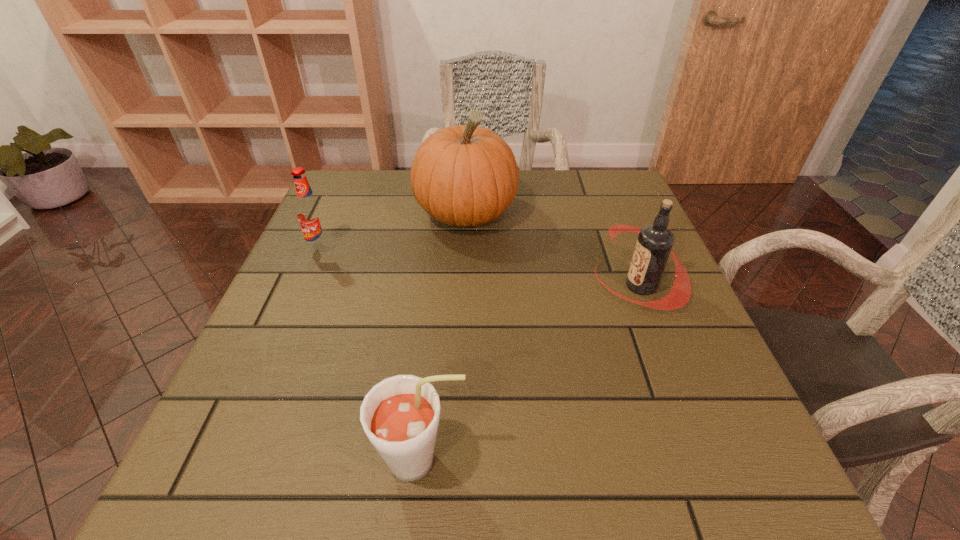
This screenshot has width=960, height=540. I want to click on vacant space at the right edge of the desktop, so click(662, 428).

Where is `free location at the far left corner`? The image size is (960, 540). free location at the far left corner is located at coordinates (375, 186).

Locate an element on the screen. free space at the near left corner of the desktop is located at coordinates (273, 449).

What are the coordinates of `blank space at the near right corner` in the screenshot? It's located at pyautogui.click(x=718, y=453).

In order to click on free space between the nearest root beer and the rightmost object in this screenshot , I will do `click(531, 373)`.

You are a GUI agent. You are given a task and a screenshot of the screen. Output one action in this format:
    pyautogui.click(x=<x>, y=<y>)
    Task: Click on the free space between the farthest root beer and the rightmost object
    This screenshot has width=960, height=540.
    Given the screenshot: What is the action you would take?
    pyautogui.click(x=480, y=267)

Locate an element on the screen. This screenshot has height=540, width=960. blank region between the pumpkin and the nearest root beer is located at coordinates (444, 337).

In order to click on free space between the nearest object and the leftmost object in this screenshot , I will do `click(372, 355)`.

This screenshot has width=960, height=540. Find the location of `unoccupied area between the nearest root beer and the rightmost object`. unoccupied area between the nearest root beer and the rightmost object is located at coordinates (531, 373).

The image size is (960, 540). In order to click on free space between the pumpkin and the leftmost root beer in this screenshot , I will do `click(394, 231)`.